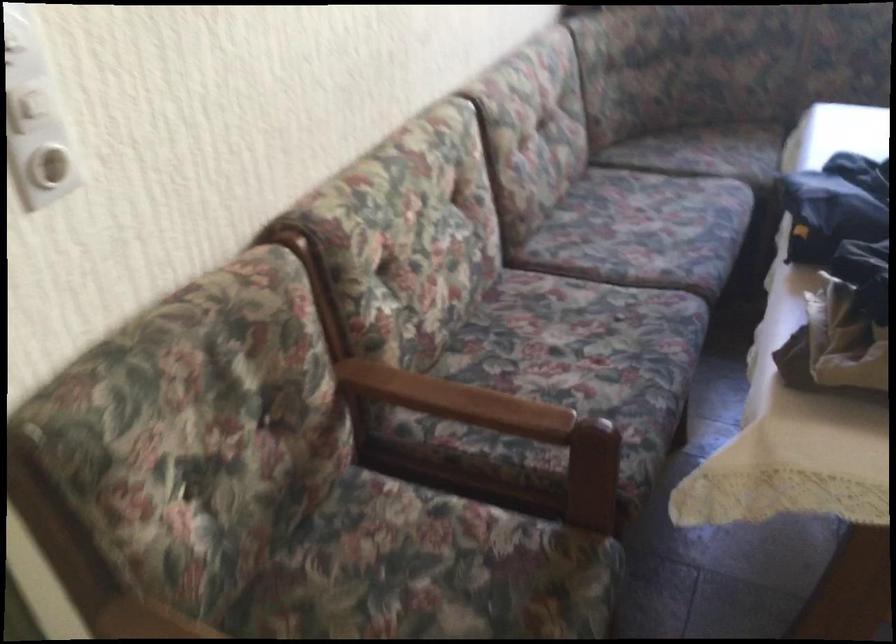
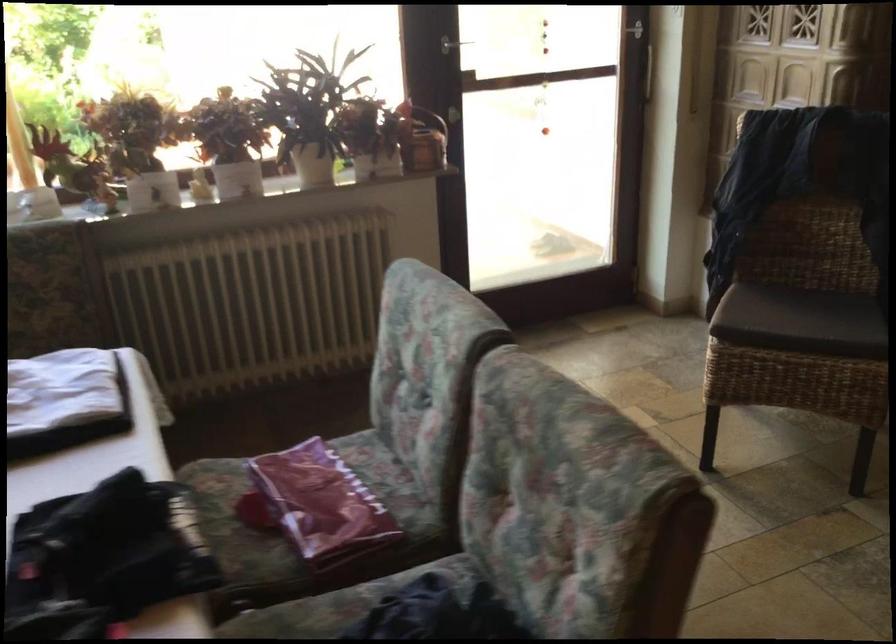
Question: Based on the continuous images, in which direction is the camera rotating? Reply with the corresponding letter.

Choices:
 (A) Left
 (B) Right
 (C) Up
 (D) Down

Answer: (B)